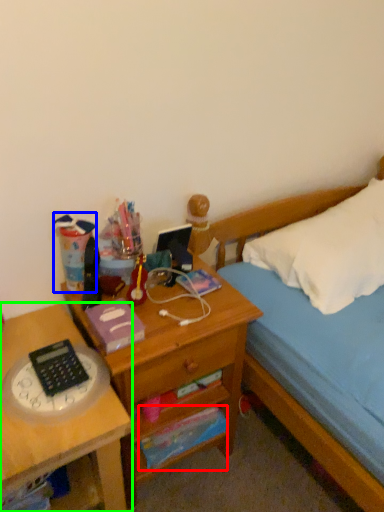
Question: Which object is positioned closest to paperback book (highlighted by a red box)? Select from stationery (highlighted by a blue box) and desk (highlighted by a green box).

Choices:
 (A) stationery
 (B) desk

Answer: (B)